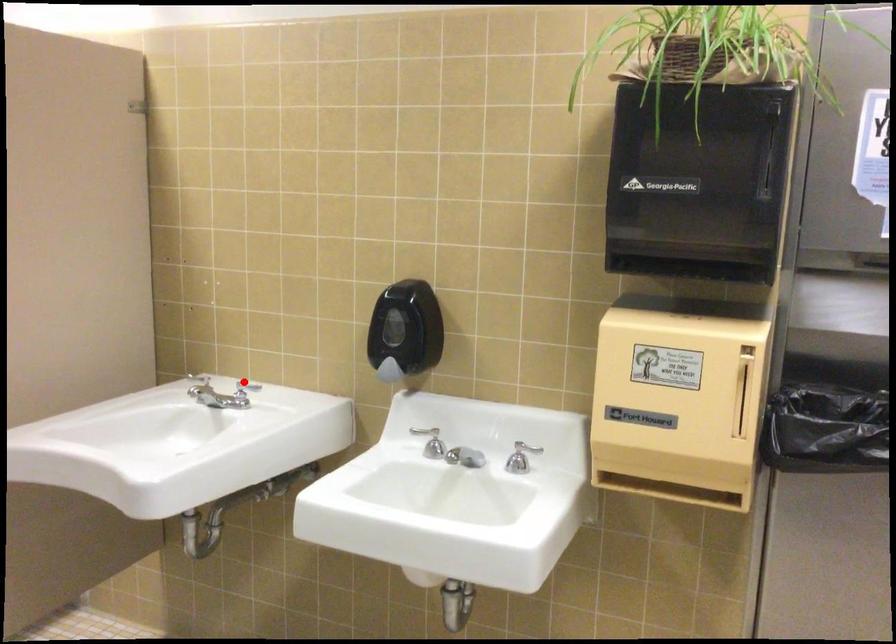
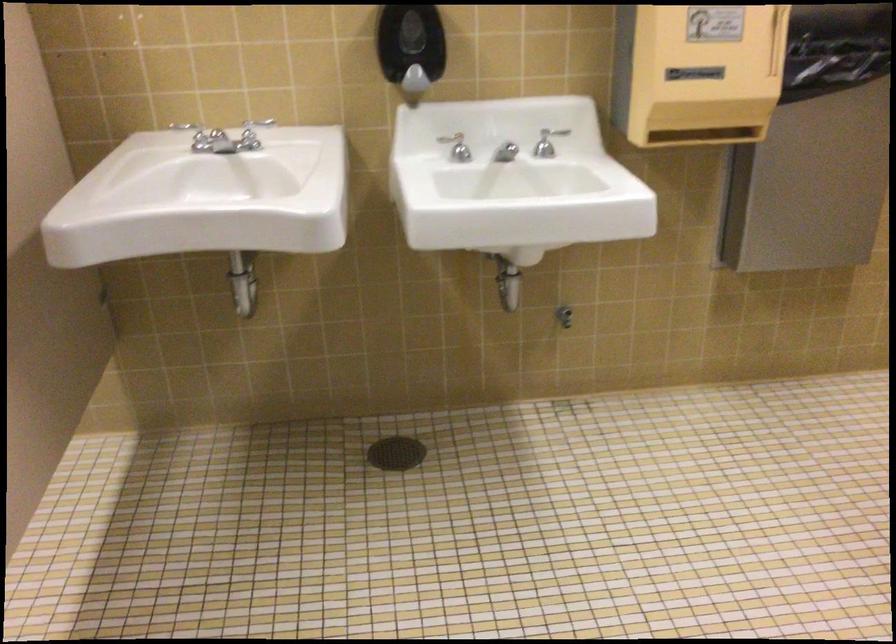
Find the pixel in the second image that matches the highlighted location in the first image.

(194, 135)